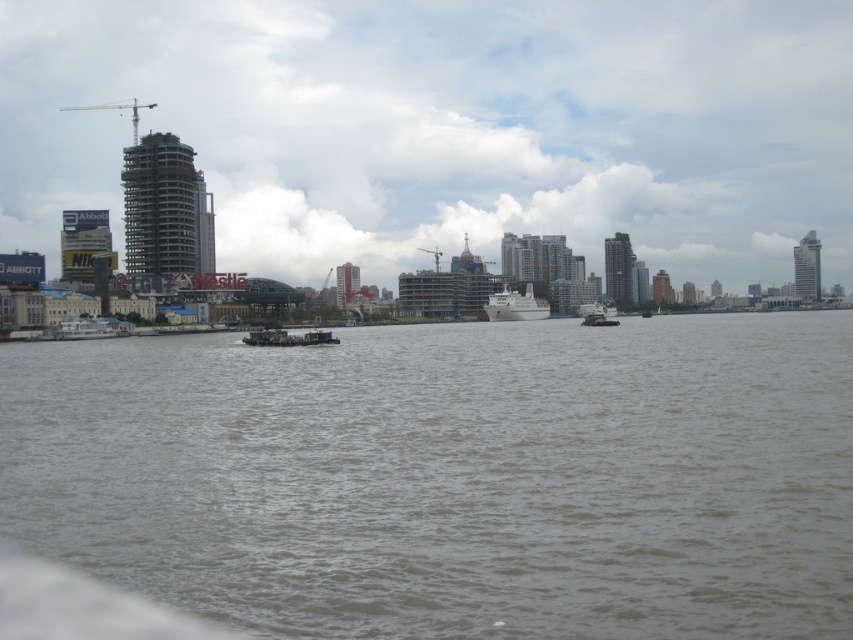
You are standing at the waterfront and want to locate two points in the image. The first point is at coordinates point (177, 339) and the second is at point (606, 305). Which point is nearer to you?

Point (177, 339) is closer to the viewer than point (606, 305).

You are a photographer standing on the dock and want to capture both the white glossy ship at center and the white matte barge at left in your photo. Which object should you focus on first if you want to ensure both are in sharp focus?

You should focus on the white glossy ship at center first because it is closer to the photographer than the white matte barge at left, ensuring both will be in focus when focused on the closer object.

You are a photographer standing on the dock and want to capture both the gray water at center and the white matte boat at center in the same frame. Which object should you focus on first if you want to ensure both are in focus?

The gray water at center is not as tall as the white matte boat at center, so you should focus on the white matte boat at center first to ensure both are in focus.